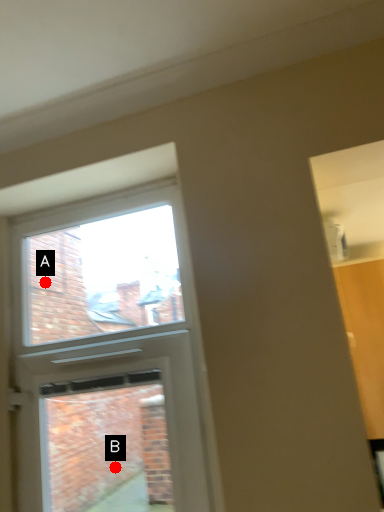
Question: Two points are circled on the image, labeled by A and B beside each circle. Which point is closer to the camera?

Choices:
 (A) A is closer
 (B) B is closer

Answer: (A)